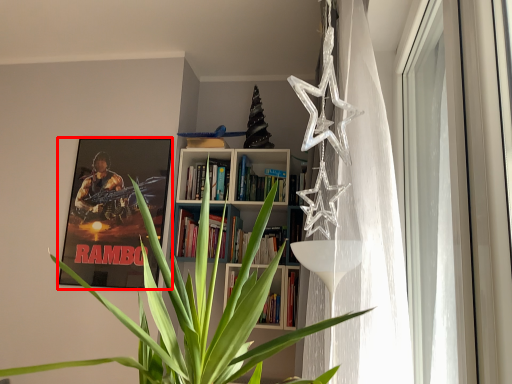
Question: From the image's perspective, what is the correct spatial relationship of picture frame (annotated by the red box) in relation to window?

Choices:
 (A) below
 (B) above

Answer: (A)